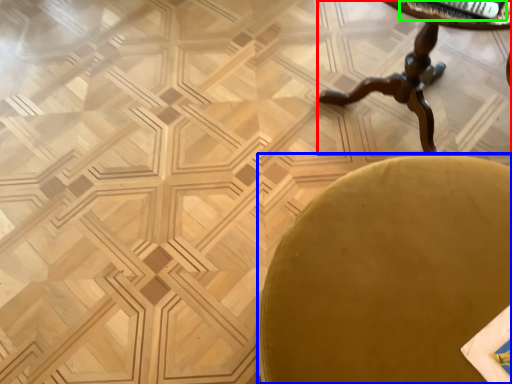
Question: Considering the real-world distances, which object is closest to table (highlighted by a red box)? chair (highlighted by a blue box) or magazine (highlighted by a green box).

Choices:
 (A) chair
 (B) magazine

Answer: (B)